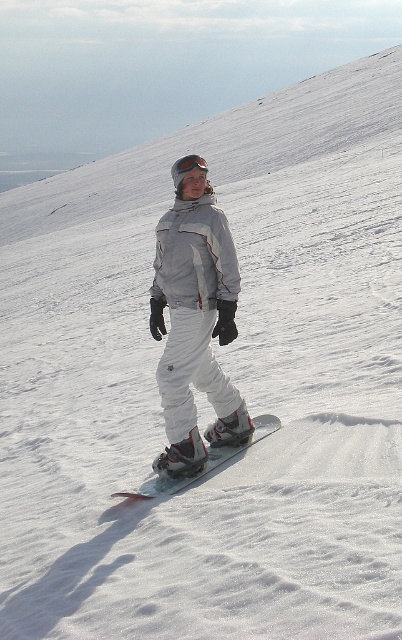
Question: Which point is closer to the camera?

Choices:
 (A) (266, 433)
 (B) (190, 282)
 (C) (196, 163)

Answer: (C)

Question: Which is nearer to the white plastic snowboard at center?

Choices:
 (A) matte black goggles at center
 (B) white matte snowboarder at center

Answer: (B)

Question: Does white matte snowboarder at center have a larger size compared to matte black goggles at center?

Choices:
 (A) yes
 (B) no

Answer: (B)

Question: Does white matte snowboarder at center have a larger size compared to white plastic snowboard at center?

Choices:
 (A) no
 (B) yes

Answer: (B)

Question: Can you confirm if white matte snowboarder at center is thinner than matte black goggles at center?

Choices:
 (A) no
 (B) yes

Answer: (B)

Question: Among these points, which one is farthest from the camera?

Choices:
 (A) (174, 173)
 (B) (164, 483)
 (C) (180, 465)

Answer: (A)